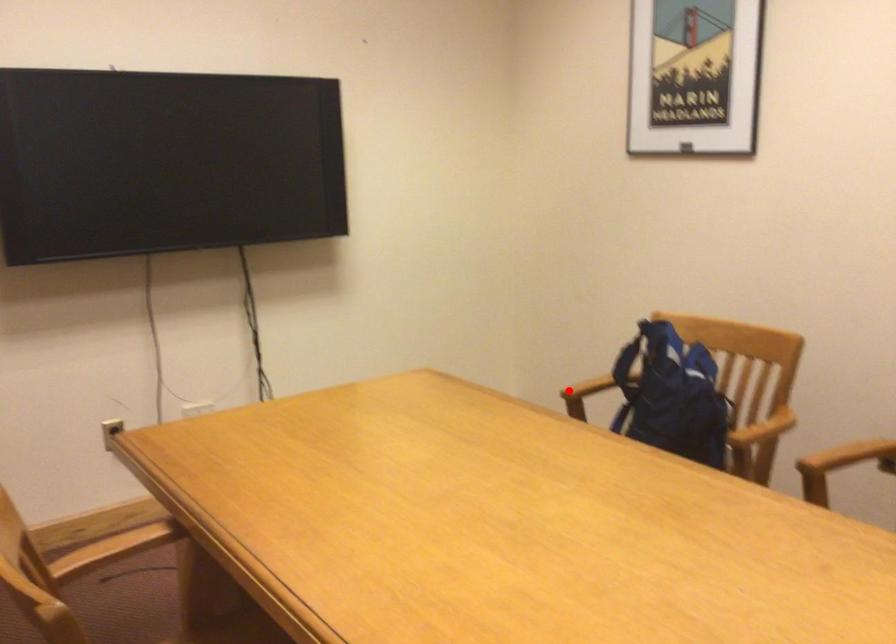
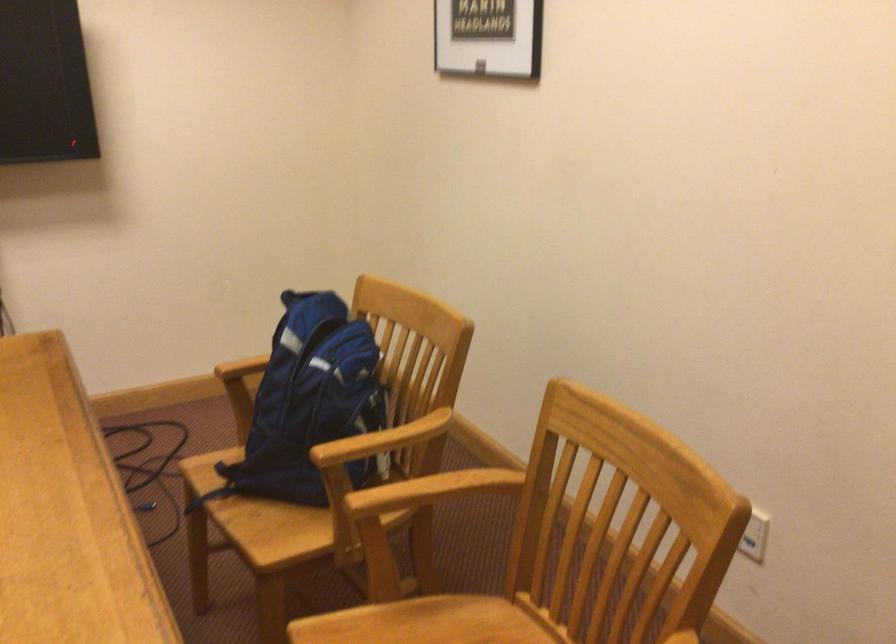
Question: I am providing you with two images of the same scene from different viewpoints. Image1 has a red point marked. In image2, the corresponding 3D location appears at what relative position? Reply with the corresponding letter.

Choices:
 (A) Closer
 (B) Farther

Answer: (A)